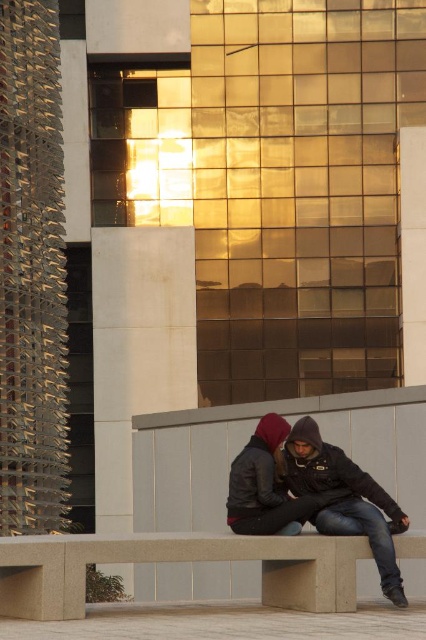
You are a photographer trying to capture a photo of the dark gray hoodie at center and the matte black leather jacket at center. Which one is positioned to the right side of the other?

The dark gray hoodie at center is to the right of the matte black leather jacket at center.

You are standing at the point marked by the coordinates point (176, 563) in the image. Looking around, you see the smooth concrete bench at center. What is the nearest object to you?

The nearest object to you is the smooth concrete bench at center, as the point (176, 563) marks its location.

You are planning to place a matte black leather jacket at center on the smooth concrete bench at center. Based on the scene description, will the jacket fit entirely on the bench?

The smooth concrete bench at center has a width larger than the matte black leather jacket at center, so the jacket will fit entirely on the bench.